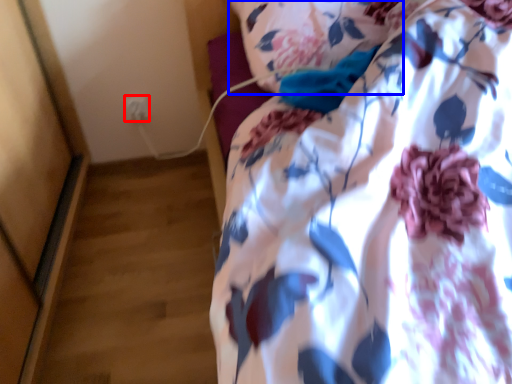
Question: Which object is further to the camera taking this photo, electric outlet (highlighted by a red box) or pillow (highlighted by a blue box)?

Choices:
 (A) electric outlet
 (B) pillow

Answer: (A)